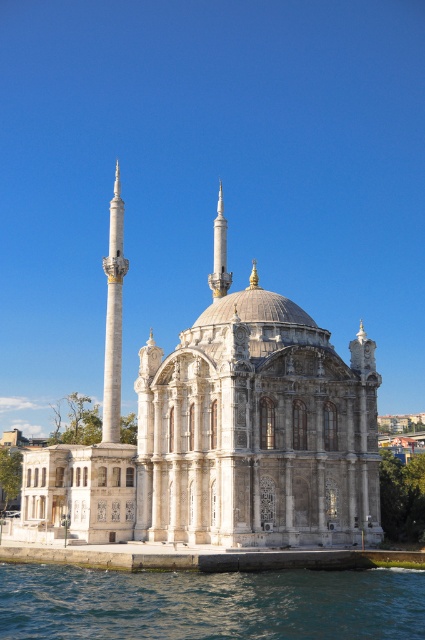
Can you confirm if white stone mosque at center is positioned to the left of white marble minaret at left?

No, white stone mosque at center is not to the left of white marble minaret at left.

Where is `white stone mosque at center`? white stone mosque at center is located at coordinates (221, 429).

Find the location of a particular element. white stone mosque at center is located at coordinates (221, 429).

What do you see at coordinates (221, 429) in the screenshot? This screenshot has height=640, width=425. I see `white stone mosque at center` at bounding box center [221, 429].

Does white stone mosque at center have a smaller size compared to blue water at lower center?

Incorrect, white stone mosque at center is not smaller in size than blue water at lower center.

Where is `white stone mosque at center`? white stone mosque at center is located at coordinates (221, 429).

The image size is (425, 640). Describe the element at coordinates (209, 604) in the screenshot. I see `blue water at lower center` at that location.

Is point (294, 620) positioned before point (119, 380)?

Yes, it is.

The width and height of the screenshot is (425, 640). I want to click on blue water at lower center, so click(x=209, y=604).